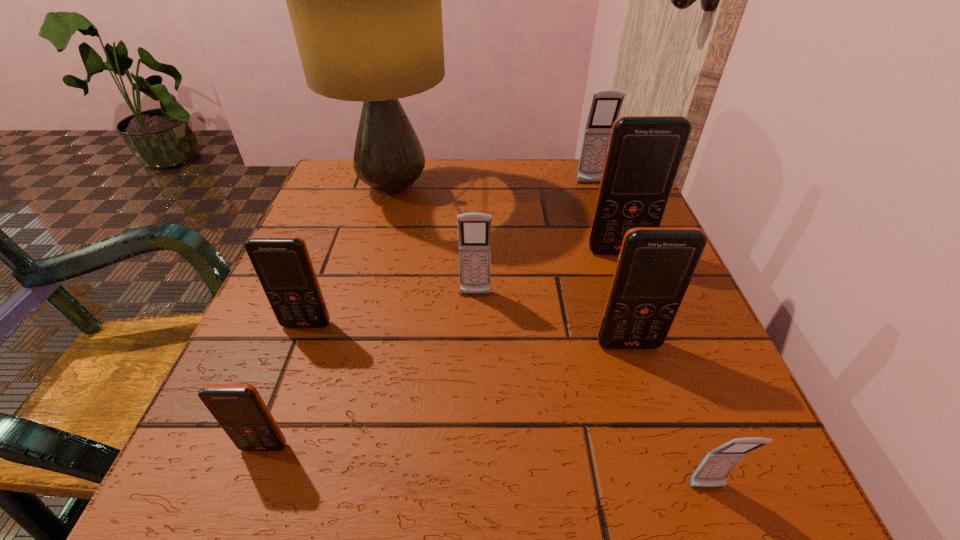
Identify the location of vacant space located 0.130m on the front-facing side of the leftmost gray cellular telephone. (474, 361).

Locate an element on the screen. free region located 0.050m on the screen of the fourth nearest object is located at coordinates (296, 354).

Where is `free point located on the screen of the nearest orange cellular telephone`? Image resolution: width=960 pixels, height=540 pixels. free point located on the screen of the nearest orange cellular telephone is located at coordinates (244, 502).

At what (x,y) coordinates should I click in order to perform the action: click on lampshade at the far edge. Please return your answer as a coordinate pair (x, y). Looking at the image, I should click on (364, 0).

Where is `cellular telephone present at the far edge`? This screenshot has height=540, width=960. cellular telephone present at the far edge is located at coordinates (605, 107).

Find the location of a particular element. This screenshot has height=540, width=960. lampshade positioned at the left edge is located at coordinates (364, 0).

In order to click on object that is positioned at the far left corner in this screenshot , I will do `click(364, 0)`.

At what (x,y) coordinates should I click in order to perform the action: click on object situated at the near left corner. Please return your answer as a coordinate pair (x, y). Looking at the image, I should click on (239, 409).

I want to click on object located at the far right corner, so click(605, 107).

Identify the location of object positioned at the near right corner. This screenshot has height=540, width=960. (713, 470).